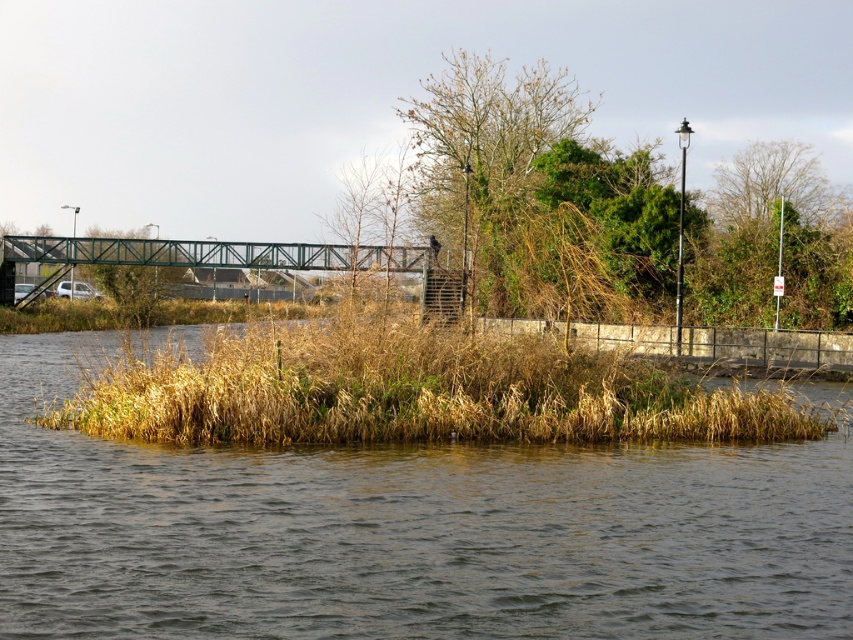
Who is more forward, (x=553, y=625) or (x=485, y=240)?

Point (x=553, y=625)

Find the location of a particular element. The width and height of the screenshot is (853, 640). brown grassy island at center is located at coordinates (407, 532).

Does point (695, 458) come closer to viewer compared to point (517, 144)?

Yes, it is.

At what (x,y) coordinates should I click in order to perform the action: click on brown grassy island at center. Please return your answer as a coordinate pair (x, y). Looking at the image, I should click on (407, 532).

Which of these two, brown grassy island at center or brown grass at center, stands shorter?

With less height is brown grassy island at center.

Does point (65, 433) come behind point (355, 346)?

Yes, point (65, 433) is farther from viewer.

You are a GUI agent. You are given a task and a screenshot of the screen. Output one action in this format:
    pyautogui.click(x=<x>, y=<y>)
    Task: Click on the brown grassy island at center
    This screenshot has width=853, height=640.
    Given the screenshot: What is the action you would take?
    pyautogui.click(x=407, y=532)

Can you confirm if brown grassy island at center is taller than green metallic bridge at center?

No, brown grassy island at center is not taller than green metallic bridge at center.

Is point (309, 476) in front of point (160, 248)?

Yes, it is.

At what (x,y) coordinates should I click in order to perform the action: click on brown grassy island at center. Please return your answer as a coordinate pair (x, y). The image size is (853, 640). Looking at the image, I should click on (407, 532).